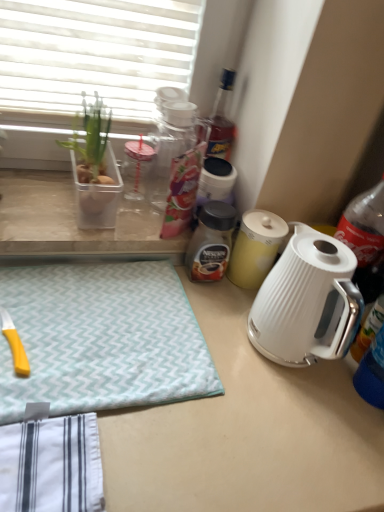
In order to click on free space above clear plastic container at left (from a real-world perspective) in this screenshot , I will do `click(104, 207)`.